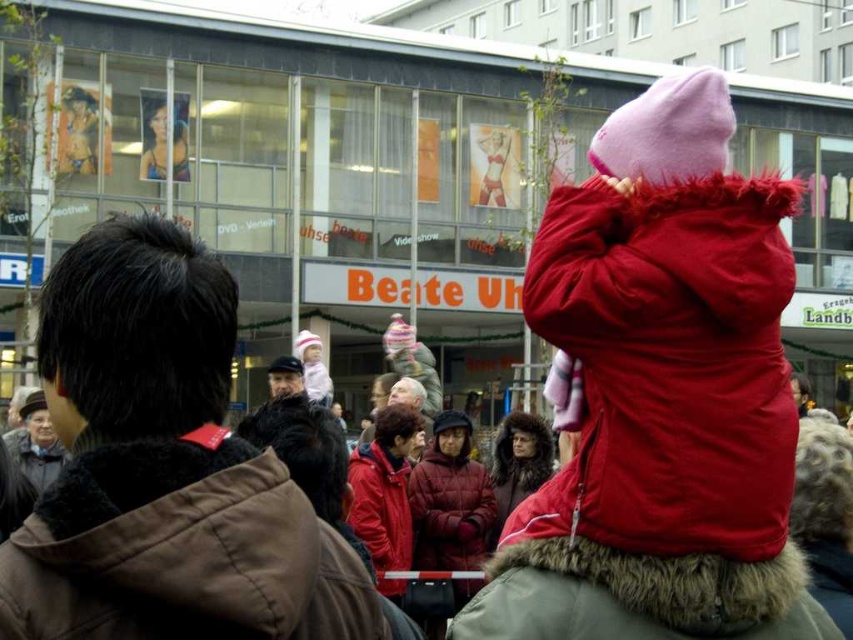
Question: Does velvet red coat at upper right appear on the left side of maroon puffy jacket at center?

Choices:
 (A) yes
 (B) no

Answer: (B)

Question: Does matte red fur coat at center have a greater width compared to smooth glossy poster at upper left?

Choices:
 (A) no
 (B) yes

Answer: (A)

Question: Which of the following is the farthest from the observer?

Choices:
 (A) (61, 522)
 (B) (438, 502)
 (C) (390, 525)
 (D) (138, 173)

Answer: (D)

Question: Does matte red fur coat at center have a lesser width compared to smooth glossy poster at upper left?

Choices:
 (A) no
 (B) yes

Answer: (B)

Question: Which object is positioned closest to the brown fur-lined jacket at lower left?

Choices:
 (A) matte red fur coat at center
 (B) smooth glossy poster at upper left
 (C) velvet red coat at upper right
 (D) red matte jacket at center

Answer: (C)

Question: Which point is closer to the camera taking this photo?

Choices:
 (A) (x=196, y=472)
 (B) (x=581, y=355)
 (C) (x=527, y=413)
 (D) (x=373, y=522)

Answer: (A)